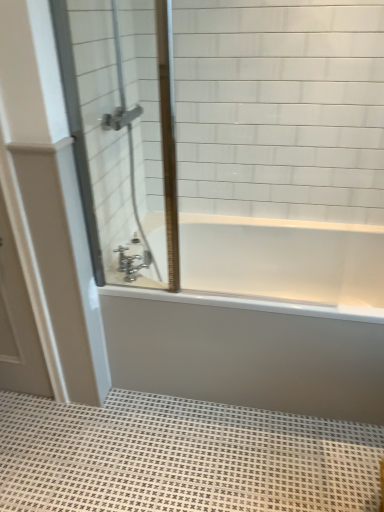
The image size is (384, 512). Identify the location of white glossy door at lower left. (18, 323).

What are the coordinates of `clear glass shower door at left` in the screenshot? It's located at (122, 129).

The width and height of the screenshot is (384, 512). I want to click on white glossy door at lower left, so click(x=18, y=323).

Considering the positions of objects white textured bath mat at lower center and clear glass shower door at left in the image provided, who is more to the left, white textured bath mat at lower center or clear glass shower door at left?

Positioned to the left is clear glass shower door at left.

Does white textured bath mat at lower center have a smaller size compared to clear glass shower door at left?

No.

Can we say white matte door at left lies outside white textured bath mat at lower center?

That's correct, white matte door at left is outside of white textured bath mat at lower center.

Is white matte door at left at the left side of white textured bath mat at lower center?

Yes, white matte door at left is to the left of white textured bath mat at lower center.

From their relative heights in the image, would you say white matte door at left is taller or shorter than white textured bath mat at lower center?

In the image, white matte door at left appears to be taller than white textured bath mat at lower center.

Considering the positions of point (28, 373) and point (76, 477), is point (28, 373) closer or farther from the camera than point (76, 477)?

Point (28, 373).

Is white glossy door at lower left inside the boundaries of white textured bath mat at lower center, or outside?

white glossy door at lower left lies outside white textured bath mat at lower center.

From a real-world perspective, who is located lower, white glossy door at lower left or white textured bath mat at lower center?

white textured bath mat at lower center, from a real-world perspective.

From the image's perspective, is white glossy door at lower left below white textured bath mat at lower center?

No, from the image's perspective, white glossy door at lower left is not beneath white textured bath mat at lower center.

From the image's perspective, which is below, white glossy door at lower left or clear glass shower door at left?

From the image's view, white glossy door at lower left is below.

Is point (15, 316) positioned behind point (69, 106)?

Yes, point (15, 316) is farther from viewer.

Is white glossy door at lower left placed right next to clear glass shower door at left?

No, white glossy door at lower left is not beside clear glass shower door at left.

Who is smaller, white glossy door at lower left or clear glass shower door at left?

white glossy door at lower left is smaller.

Between point (270, 378) and point (135, 276), which one is positioned in front?

The point (270, 378) is closer.

Could you tell me if white glossy bathtub at center is turned towards chrome metallic faucet at center?

No, white glossy bathtub at center is not aimed at chrome metallic faucet at center.

How different are the orientations of white glossy bathtub at center and chrome metallic faucet at center in degrees?

white glossy bathtub at center and chrome metallic faucet at center are facing 122 degrees away from each other.

Is the depth of white glossy bathtub at center greater than that of chrome metallic faucet at center?

That is False.

Is white glossy door at lower left to the right of chrome metallic faucet at center from the viewer's perspective?

No.

You are a GUI agent. You are given a task and a screenshot of the screen. Output one action in this format:
    pyautogui.click(x=<x>, y=<y>)
    Task: Click on the screen door that is on the left side of chrome metallic faucet at center
    The height and width of the screenshot is (512, 384).
    Given the screenshot: What is the action you would take?
    pyautogui.click(x=18, y=323)

Considering the relative sizes of white glossy door at lower left and chrome metallic faucet at center in the image provided, is white glossy door at lower left thinner than chrome metallic faucet at center?

Correct, the width of white glossy door at lower left is less than that of chrome metallic faucet at center.

Which object is further away from the camera taking this photo, white glossy door at lower left or chrome metallic faucet at center?

chrome metallic faucet at center is behind.

From the image's perspective, relative to white glossy bathtub at center, is white matte door at left above or below?

From the image's perspective, white matte door at left appears above white glossy bathtub at center.

Is white matte door at left wider or thinner than white glossy bathtub at center?

Clearly, white matte door at left has less width compared to white glossy bathtub at center.

Between point (19, 12) and point (240, 251), which one is positioned behind?

The point (240, 251) is more distant.

The image size is (384, 512). In order to click on shower door above the white textured bath mat at lower center (from a real-world perspective) in this screenshot , I will do `click(122, 129)`.

Where is `bath mat on the right side of white matte door at left`? The height and width of the screenshot is (512, 384). bath mat on the right side of white matte door at left is located at coordinates (181, 457).

Looking at this image, considering their positions, is white textured bath mat at lower center positioned closer to white glossy bathtub at center than white matte door at left?

white textured bath mat at lower center is positioned closer to the anchor white glossy bathtub at center.

When comparing their distances from white matte door at left, does white glossy door at lower left or white textured bath mat at lower center seem further?

white textured bath mat at lower center.

From the image, which object appears to be farther from white matte door at left, white textured bath mat at lower center or clear glass shower door at left?

white textured bath mat at lower center lies further to white matte door at left than the other object.

From the image, which object appears to be nearer to white glossy bathtub at center, clear glass shower door at left or white textured bath mat at lower center?

white textured bath mat at lower center.

Which object lies further to the anchor point clear glass shower door at left, white matte door at left or white glossy door at lower left?

white glossy door at lower left.

Based on their spatial positions, is white glossy door at lower left or white matte door at left further from white textured bath mat at lower center?

Based on the image, white matte door at left appears to be further to white textured bath mat at lower center.

Which object lies nearer to the anchor point chrome metallic faucet at center, white textured bath mat at lower center or white matte door at left?

Based on the image, white matte door at left appears to be nearer to chrome metallic faucet at center.

Estimate the real-world distances between objects in this image. Which object is closer to chrome metallic faucet at center, white textured bath mat at lower center or clear glass shower door at left?

clear glass shower door at left is positioned closer to the anchor chrome metallic faucet at center.

Locate an element on the screen. This screenshot has height=512, width=384. door located between white glossy door at lower left and chrome metallic faucet at center in the left-right direction is located at coordinates (49, 199).

Locate an element on the screen. Image resolution: width=384 pixels, height=512 pixels. screen door between clear glass shower door at left and white textured bath mat at lower center in the vertical direction is located at coordinates (18, 323).

The image size is (384, 512). What are the coordinates of `bath mat located between white glossy door at lower left and white glossy bathtub at center in the left-right direction` in the screenshot? It's located at (181, 457).

This screenshot has height=512, width=384. I want to click on tap between white matte door at left and white glossy bathtub at center, so click(x=132, y=259).